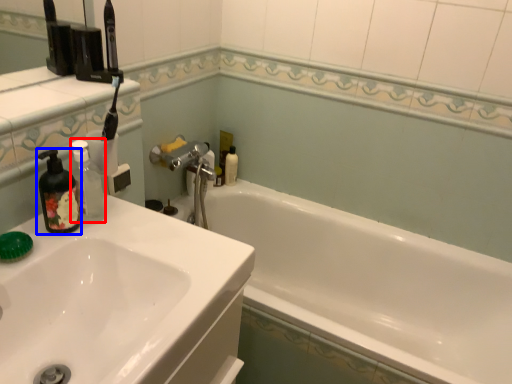
Question: Which object appears closest to the camera in this image, bottle (highlighted by a red box) or soap dispenser (highlighted by a blue box)?

Choices:
 (A) bottle
 (B) soap dispenser

Answer: (B)